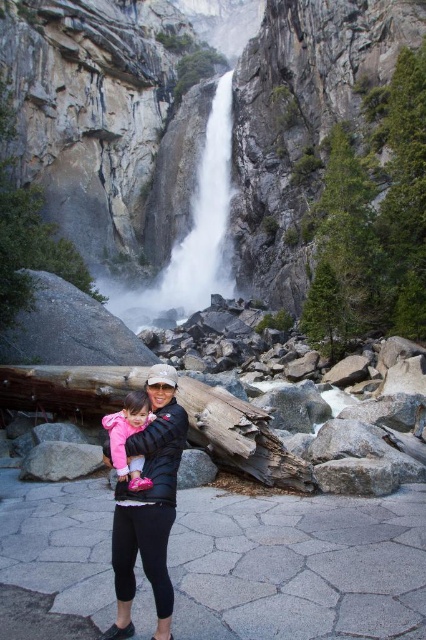
Based on the photo, you are standing on the paved pathway and want to take a photo of the white frothy water at center and the pink fabric dress at center. Which object should you focus on first to ensure both are in frame?

You should focus on the pink fabric dress at center first because the white frothy water at center is to the left of it, so by centering the dress, the water will naturally be included in the frame to its left.

You are a photographer trying to capture a photo of the matte black jacket at center and the pink fabric dress at center. Which one should you focus on first if you want to highlight the larger object?

The matte black jacket at center is bigger than the pink fabric dress at center, so you should focus on the matte black jacket at center first to highlight the larger object.